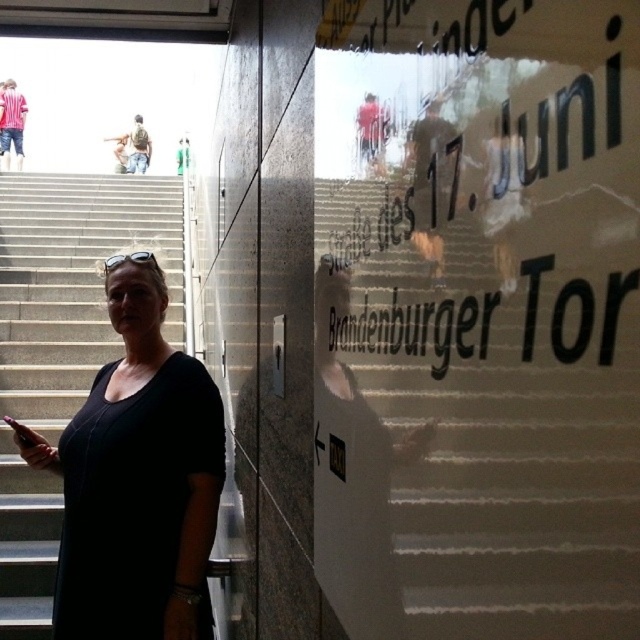
You are a fashion designer observing a woman wearing a black matte dress at center and a denim jacket at upper left. Which piece of clothing is positioned closer to the front of the image?

The black matte dress at center is closer to the viewer than the denim jacket at upper left, so the black matte dress at center is positioned closer to the front of the image.